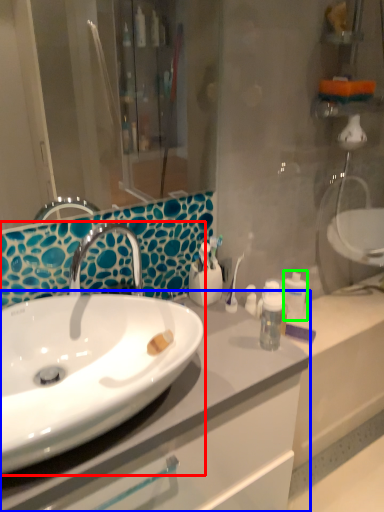
Question: Considering the real-world distances, which object is closest to sink (highlighted by a red box)? bathroom cabinet (highlighted by a blue box) or mouthwash (highlighted by a green box).

Choices:
 (A) bathroom cabinet
 (B) mouthwash

Answer: (A)